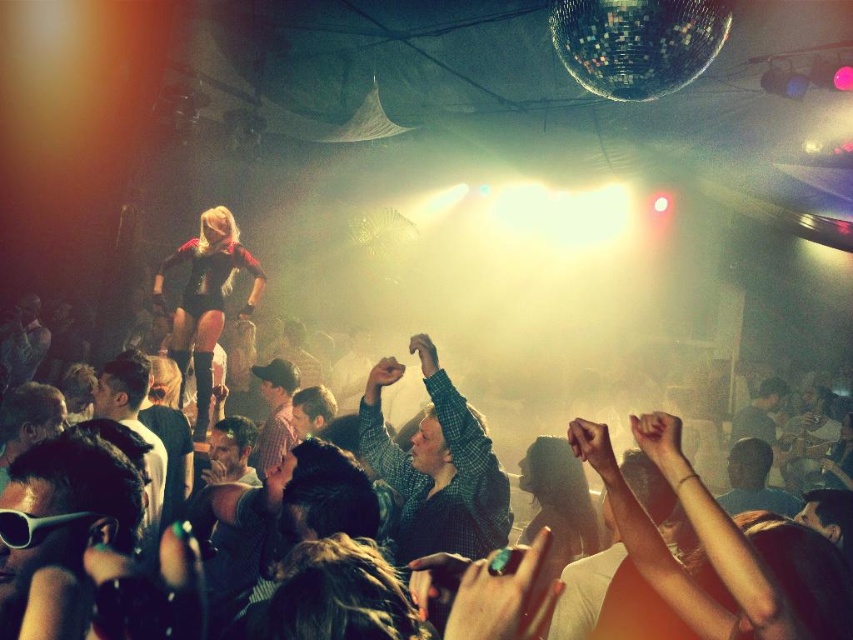
From the picture: Is green checkered shirt at center below black leather outfit at center?

Correct, green checkered shirt at center is located below black leather outfit at center.

Does point (369, 385) lie in front of point (207, 340)?

Yes, point (369, 385) is in front of point (207, 340).

Image resolution: width=853 pixels, height=640 pixels. Identify the location of green checkered shirt at center. (436, 467).